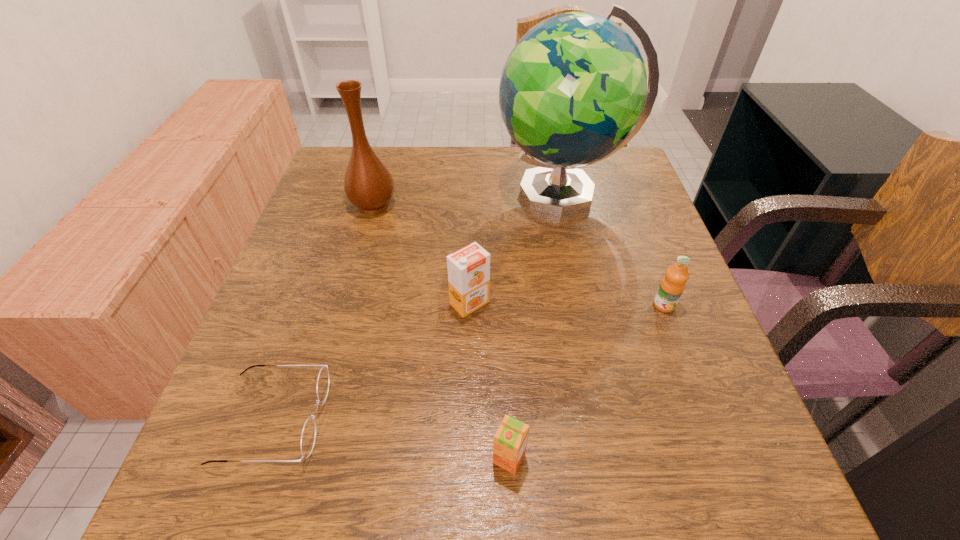
Locate an element on the screen. The height and width of the screenshot is (540, 960). free location located on the label of the rightmost orange juice is located at coordinates (720, 455).

The width and height of the screenshot is (960, 540). What are the coordinates of `vacant space located 0.080m on the left of the shortest orange juice` in the screenshot? It's located at (441, 458).

At what (x,y) coordinates should I click in order to perform the action: click on vacant point located on the front-facing side of the spectacles. Please return your answer as a coordinate pair (x, y). Image resolution: width=960 pixels, height=540 pixels. Looking at the image, I should click on (557, 419).

Find the location of a particular element. The height and width of the screenshot is (540, 960). globe that is at the far edge is located at coordinates (573, 91).

You are a GUI agent. You are given a task and a screenshot of the screen. Output one action in this format:
    pyautogui.click(x=<x>, y=<y>)
    Task: Click on the vase at the far edge
    
    Given the screenshot: What is the action you would take?
    pyautogui.click(x=368, y=184)

Where is `orange juice that is at the near edge`? orange juice that is at the near edge is located at coordinates (510, 440).

The image size is (960, 540). In order to click on spectacles that is at the near edge in this screenshot , I will do `click(309, 432)`.

Identify the location of vase situated at the left edge. The image size is (960, 540). (368, 184).

Where is `spectacles located in the left edge section of the desktop`? Image resolution: width=960 pixels, height=540 pixels. spectacles located in the left edge section of the desktop is located at coordinates click(309, 432).

Locate an element on the screen. This screenshot has height=540, width=960. globe at the right edge is located at coordinates [573, 91].